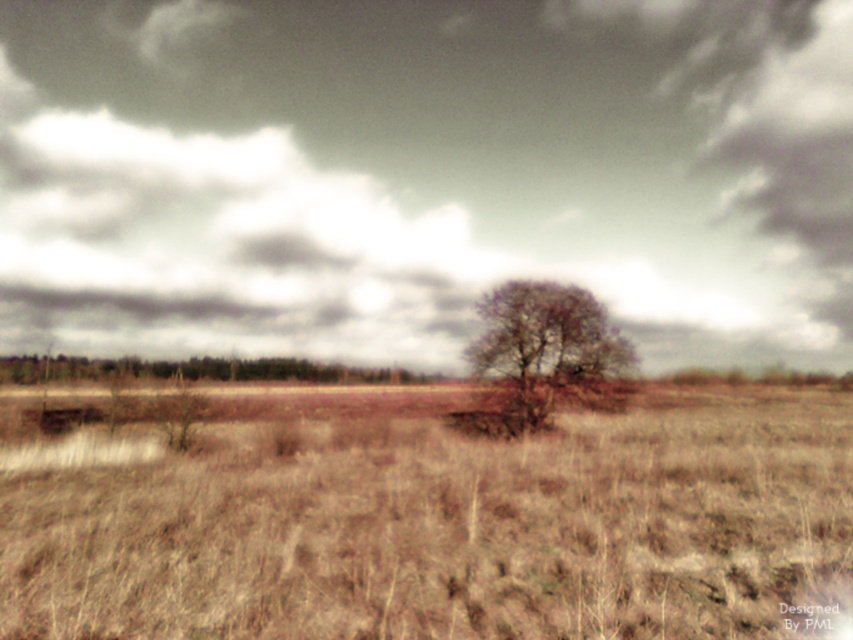
Question: Can you confirm if brown dry grass at center is thinner than bare branches at center?

Choices:
 (A) yes
 (B) no

Answer: (B)

Question: Is bare branches at center closer to the viewer compared to brown matte tree at center?

Choices:
 (A) yes
 (B) no

Answer: (B)

Question: Is brown textured tree at center bigger than brown dry grass at center?

Choices:
 (A) no
 (B) yes

Answer: (B)

Question: Which point is farther to the camera?

Choices:
 (A) brown textured tree at center
 (B) brown dry grass at center

Answer: (A)

Question: Considering the real-world distances, which object is farthest from the brown textured tree at center?

Choices:
 (A) bare branches at center
 (B) brown matte tree at center

Answer: (A)

Question: Which is nearer to the bare branches at center?

Choices:
 (A) brown dry grass at center
 (B) brown matte tree at center

Answer: (A)